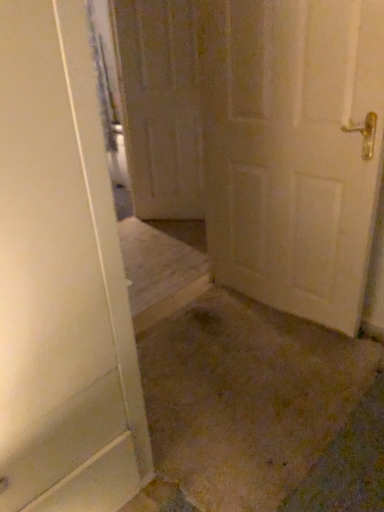
Question: Relative to wooden door at center, which is the first door from left to right, is white matte door at center, the 2th door when ordered from left to right, in front or behind?

Choices:
 (A) front
 (B) behind

Answer: (A)

Question: Considering the positions of white matte door at center, marked as the second door in a back-to-front arrangement, and wooden door at center, acting as the first door starting from the back, in the image, is white matte door at center, marked as the second door in a back-to-front arrangement, wider or thinner than wooden door at center, acting as the first door starting from the back,?

Choices:
 (A) wide
 (B) thin

Answer: (A)

Question: In terms of height, does white matte door at center, placed as the 1th door when sorted from front to back, look taller or shorter compared to wooden door at center, acting as the first door starting from the back?

Choices:
 (A) short
 (B) tall

Answer: (A)

Question: Is wooden door at center, acting as the first door starting from the back, situated inside white matte door at center, arranged as the 1th door when viewed from the right, or outside?

Choices:
 (A) outside
 (B) inside

Answer: (A)

Question: In terms of width, does wooden door at center, acting as the first door starting from the back, look wider or thinner when compared to white matte door at center, the 2th door when ordered from left to right?

Choices:
 (A) wide
 (B) thin

Answer: (B)

Question: Is wooden door at center, marked as the 2th door in a right-to-left arrangement, taller or shorter than white matte door at center, arranged as the 1th door when viewed from the right?

Choices:
 (A) short
 (B) tall

Answer: (B)

Question: From a real-world perspective, is wooden door at center, marked as the 2th door in a right-to-left arrangement, positioned above or below white matte door at center, placed as the 1th door when sorted from front to back?

Choices:
 (A) below
 (B) above

Answer: (B)